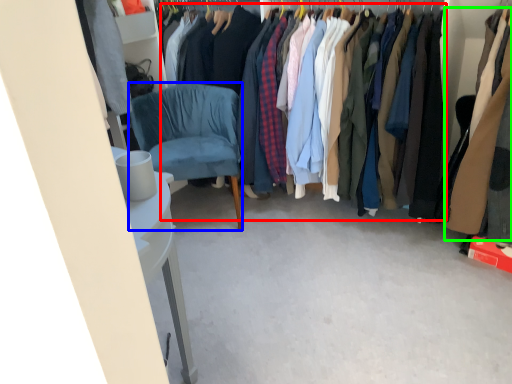
Question: Estimate the real-world distances between objects in this image. Which object is closer to clothing (highlighted by a red box), chair (highlighted by a blue box) or clothing (highlighted by a green box)?

Choices:
 (A) chair
 (B) clothing

Answer: (B)